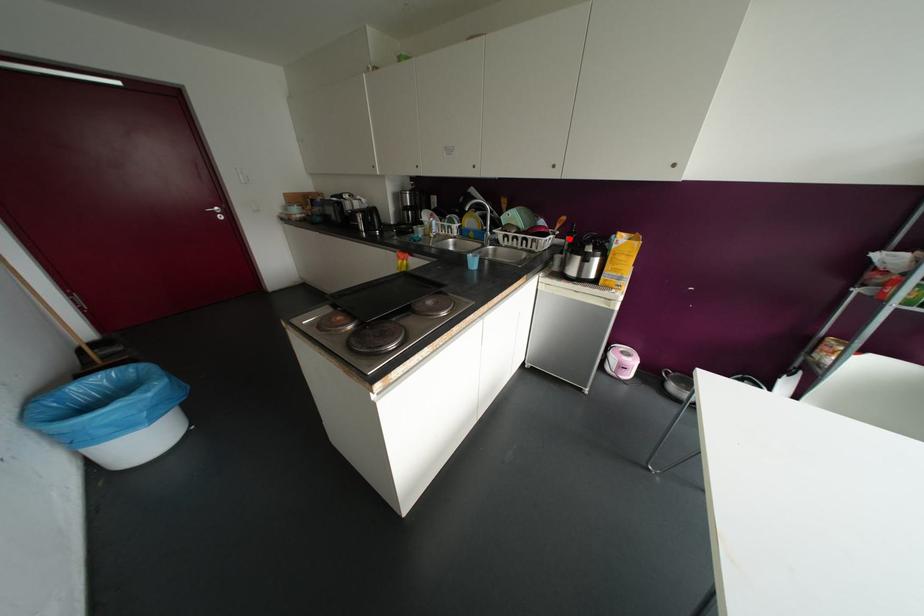
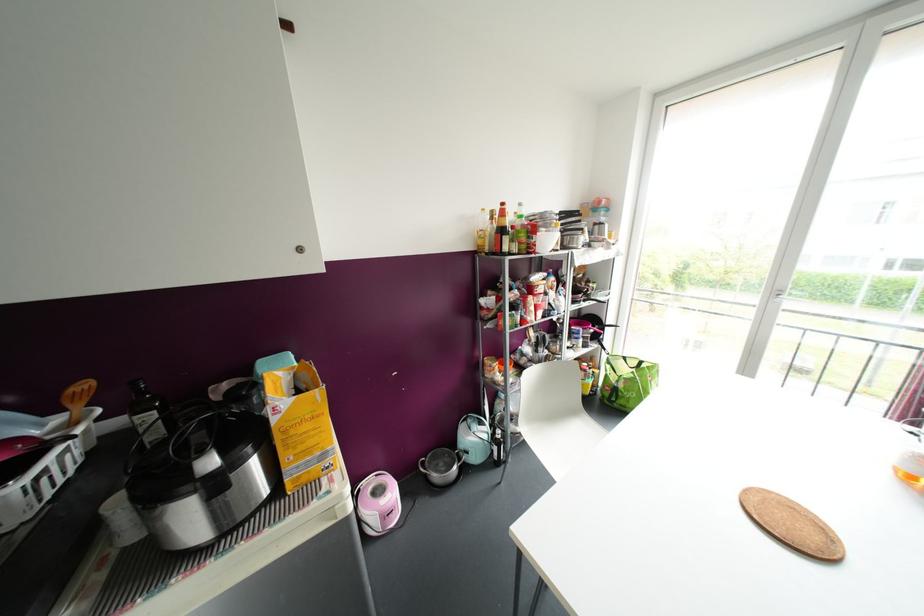
In the second image, find the point that corresponds to the highlighted location in the first image.

(150, 416)